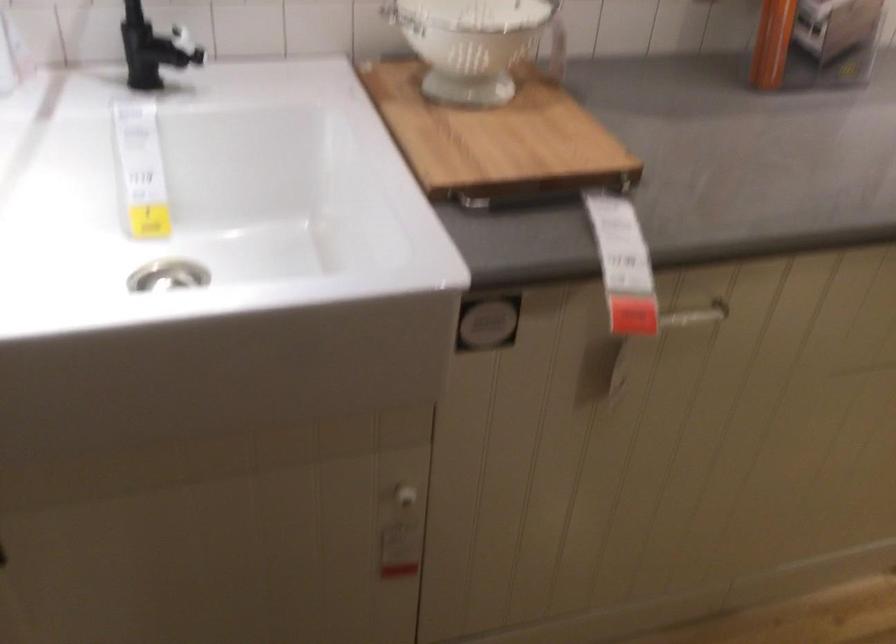
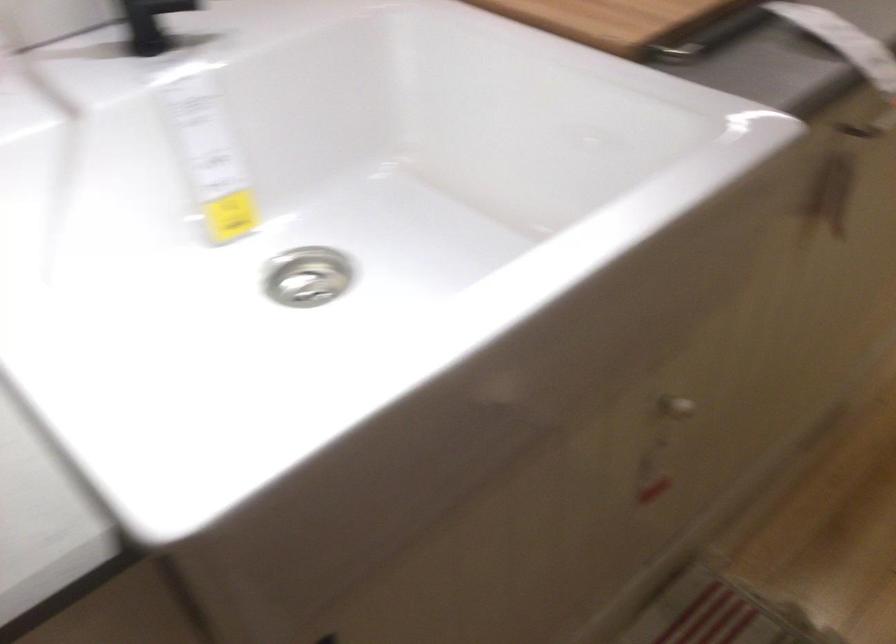
Question: The images are taken continuously from a first-person perspective. In which direction is your viewpoint rotating?

Choices:
 (A) Left
 (B) Right
 (C) Up
 (D) Down

Answer: (B)